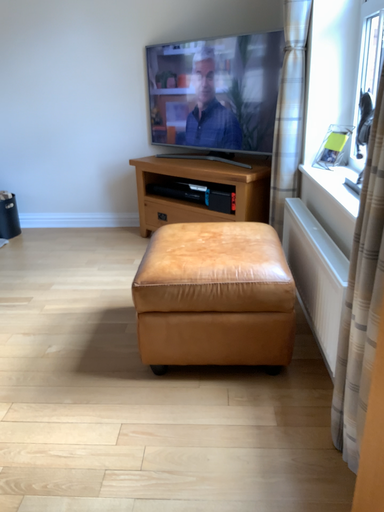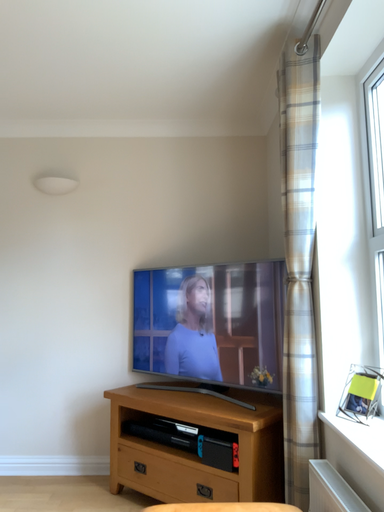
Question: How did the camera likely rotate when shooting the video?

Choices:
 (A) rotated downward
 (B) rotated upward

Answer: (B)